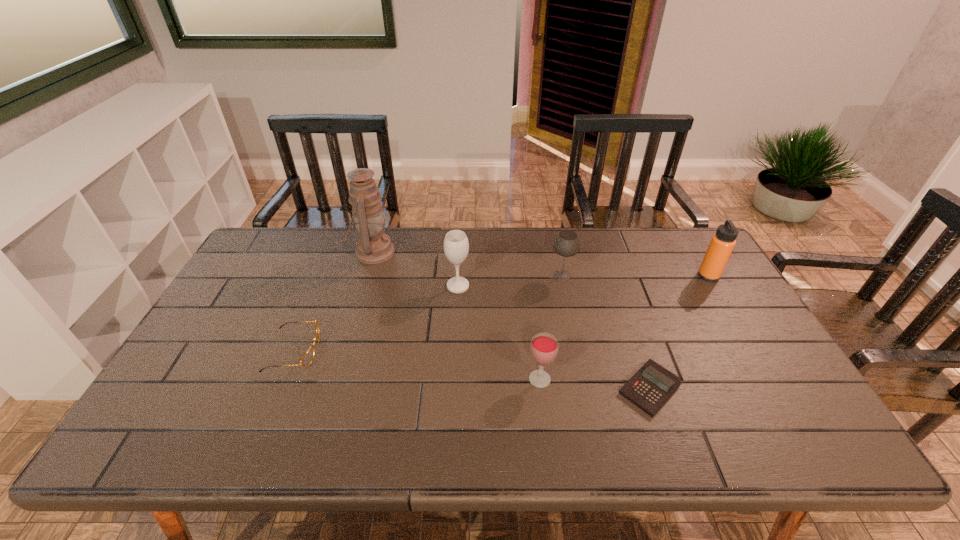
Point out which wineglass is positioned as the second nearest to the rightmost object. Please provide its 2D coordinates. Your answer should be formatted as a tuple, i.e. [(x, y)], where the tuple contains the x and y coordinates of a point satisfying the conditions above.

[(544, 347)]

I want to click on the closest wineglass relative to the fifth object from right to left, so click(x=566, y=244).

You are a GUI agent. You are given a task and a screenshot of the screen. Output one action in this format:
    pyautogui.click(x=<x>, y=<y>)
    Task: Click on the blank space that satisfies the following two spatial constraints: 1. on the front-facing side of the spectacles; 2. on the left side of the calculator
    The width and height of the screenshot is (960, 540).
    Given the screenshot: What is the action you would take?
    pyautogui.click(x=278, y=388)